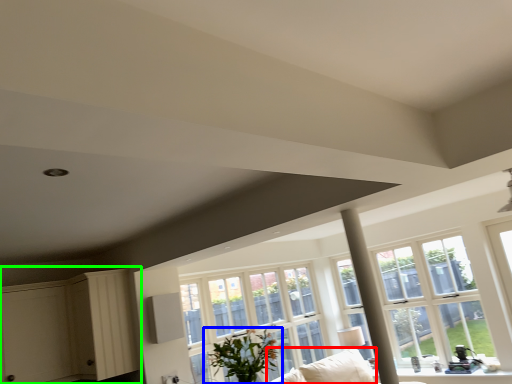
Question: Estimate the real-world distances between objects in this image. Which object is farther from couch (highlighted by a red box), houseplant (highlighted by a blue box) or dresser (highlighted by a green box)?

Choices:
 (A) houseplant
 (B) dresser

Answer: (B)